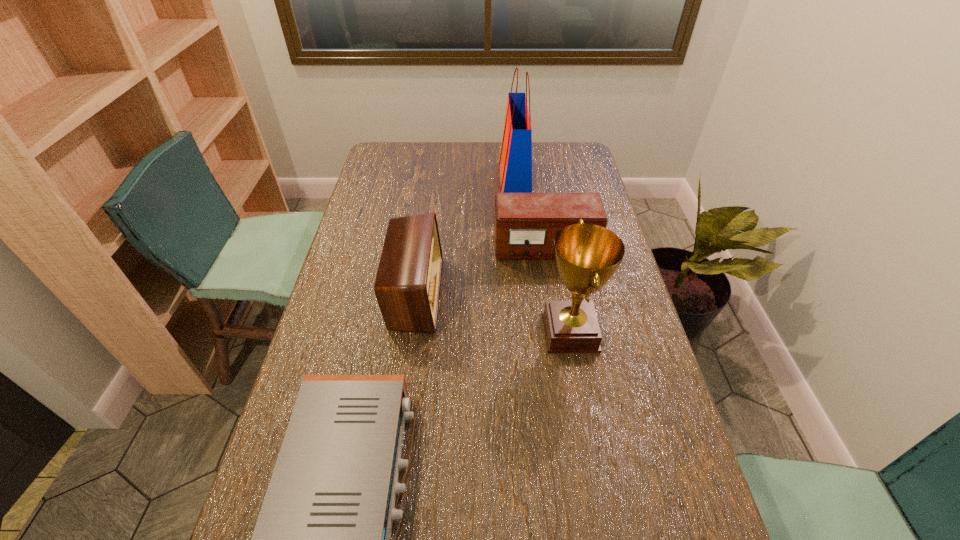
Where is `free spot between the rightmost radio receiver and the award`? This screenshot has height=540, width=960. free spot between the rightmost radio receiver and the award is located at coordinates (558, 291).

Where is `object that is the second closest to the farthest object`? The image size is (960, 540). object that is the second closest to the farthest object is located at coordinates tap(407, 286).

Locate which object ranks third in proximity to the shortest object. Please provide its 2D coordinates. Your answer should be formatted as a tuple, i.e. [(x, y)], where the tuple contains the x and y coordinates of a point satisfying the conditions above.

[(525, 224)]

The height and width of the screenshot is (540, 960). Find the location of `radio receiver that is the second closest to the nearest radio receiver`. radio receiver that is the second closest to the nearest radio receiver is located at coordinates (525, 224).

Choose which radio receiver is the third nearest neighbor to the shopping bag. Please provide its 2D coordinates. Your answer should be formatted as a tuple, i.e. [(x, y)], where the tuple contains the x and y coordinates of a point satisfying the conditions above.

[(322, 539)]